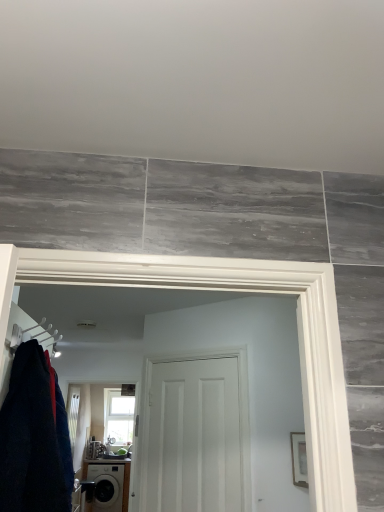
Question: Considering the relative sizes of clear glass window at upper center and white matte ceiling at upper center in the image provided, is clear glass window at upper center shorter than white matte ceiling at upper center?

Choices:
 (A) yes
 (B) no

Answer: (B)

Question: Is clear glass window at upper center closer to camera compared to white matte ceiling at upper center?

Choices:
 (A) yes
 (B) no

Answer: (B)

Question: Can you confirm if clear glass window at upper center is smaller than white matte ceiling at upper center?

Choices:
 (A) yes
 (B) no

Answer: (B)

Question: Is the surface of clear glass window at upper center in direct contact with white matte ceiling at upper center?

Choices:
 (A) no
 (B) yes

Answer: (A)

Question: Is clear glass window at upper center looking in the opposite direction of white matte ceiling at upper center?

Choices:
 (A) yes
 (B) no

Answer: (B)

Question: Can you confirm if clear glass window at upper center is bigger than white matte ceiling at upper center?

Choices:
 (A) no
 (B) yes

Answer: (B)

Question: From a real-world perspective, does white matte door at center sit lower than clear glass window at upper center?

Choices:
 (A) yes
 (B) no

Answer: (B)

Question: Is white matte door at center not within clear glass window at upper center?

Choices:
 (A) no
 (B) yes

Answer: (B)

Question: Considering the relative sizes of white matte door at center and clear glass window at upper center in the image provided, is white matte door at center shorter than clear glass window at upper center?

Choices:
 (A) no
 (B) yes

Answer: (B)

Question: From the image's perspective, would you say white matte door at center is shown under clear glass window at upper center?

Choices:
 (A) no
 (B) yes

Answer: (A)

Question: Is clear glass window at upper center at the back of white matte door at center?

Choices:
 (A) no
 (B) yes

Answer: (A)

Question: Does white matte door at center come behind clear glass window at upper center?

Choices:
 (A) yes
 (B) no

Answer: (B)

Question: Is clear glass window at upper center far from white plastic hanger at left?

Choices:
 (A) no
 (B) yes

Answer: (B)